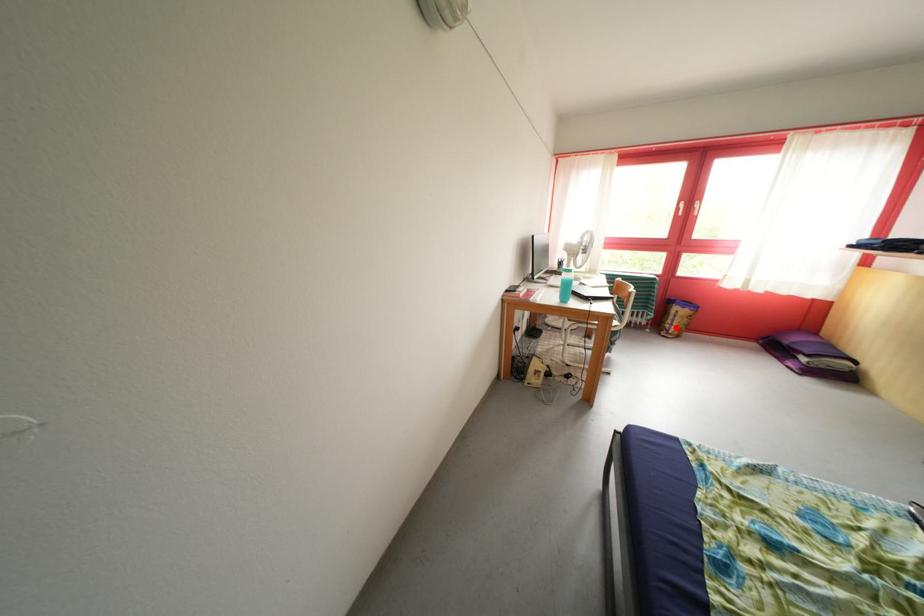
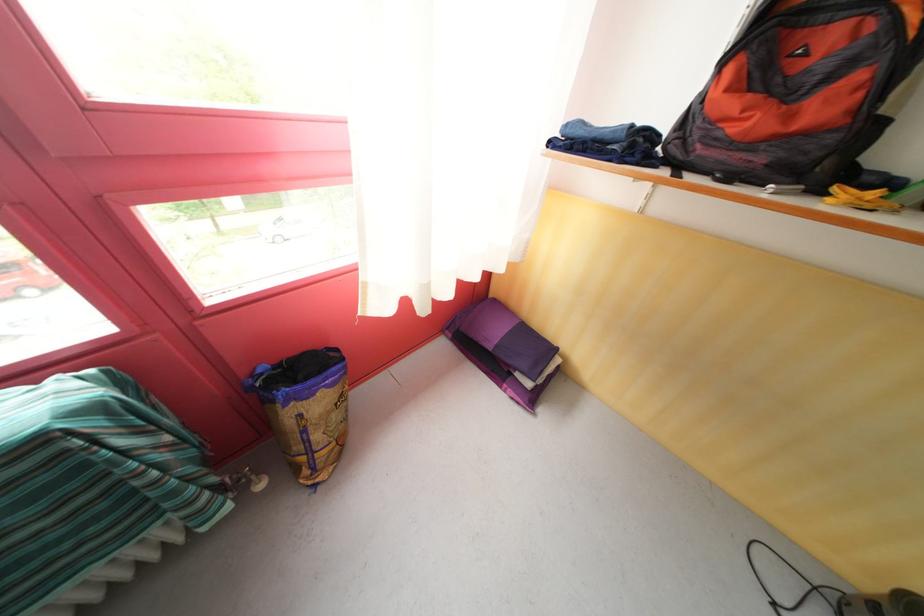
In the second image, find the point that corresponds to the highlighted location in the first image.

(305, 454)